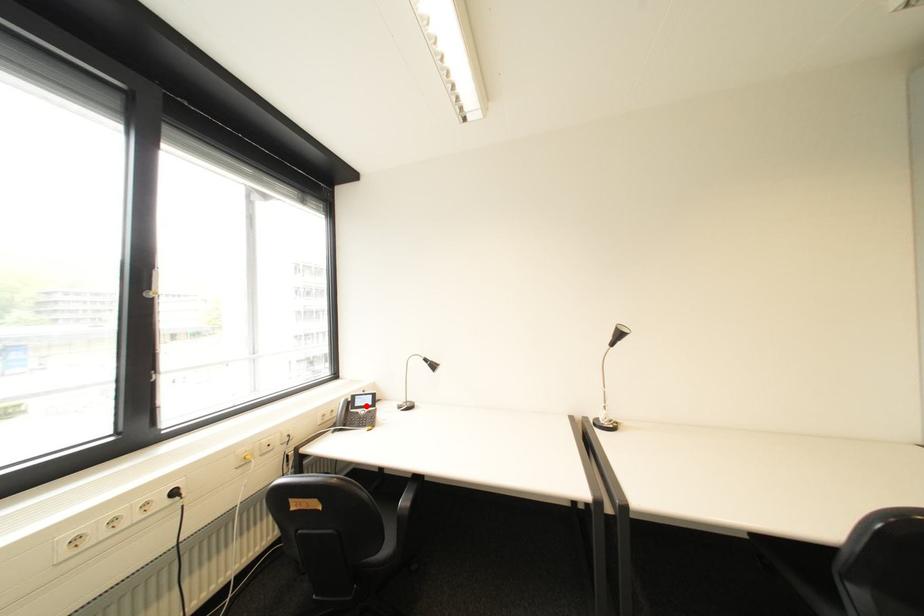
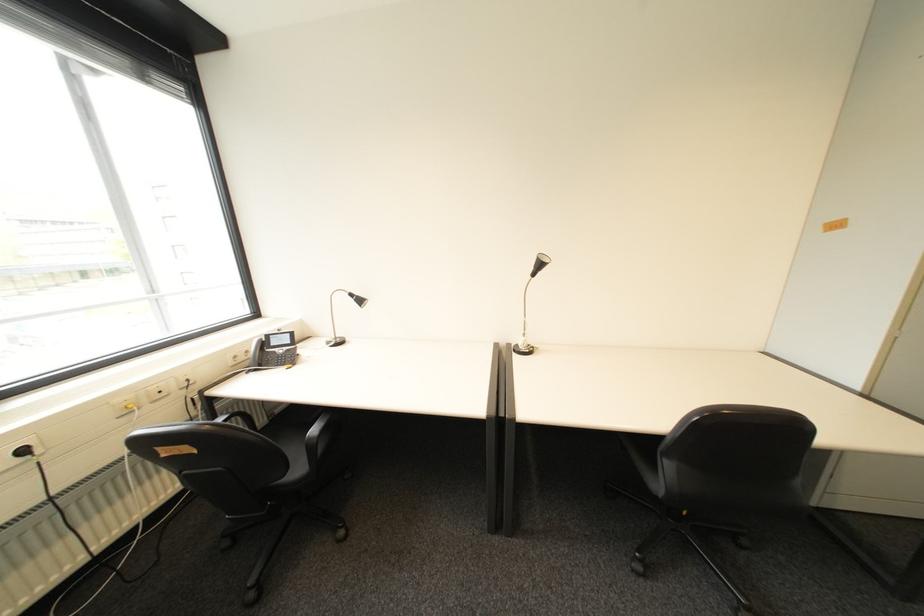
Question: A red point is marked in image1. In image2, is the corresponding 3D point closer to the camera or farther? Reply with the corresponding letter.

Choices:
 (A) The corresponding 3D point is closer.
 (B) The corresponding 3D point is farther.

Answer: (A)